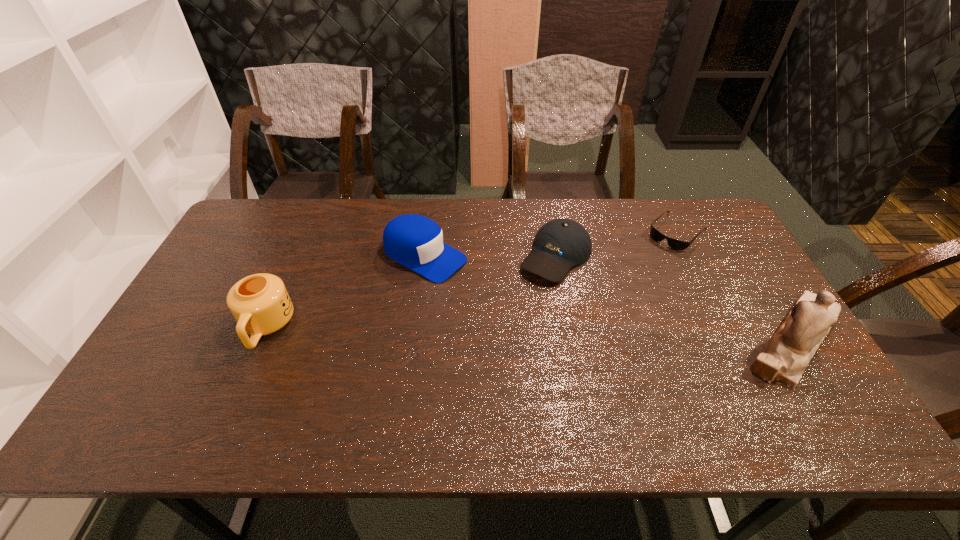
Identify the location of figurine present at the right edge. pos(785,358).

Where is `sunglasses that is at the right edge`? Image resolution: width=960 pixels, height=540 pixels. sunglasses that is at the right edge is located at coordinates (676, 244).

You are a GUI agent. You are given a task and a screenshot of the screen. Output one action in this format:
    pyautogui.click(x=<x>, y=<y>)
    Task: Click on the object present at the far right corner
    The image size is (960, 540).
    Given the screenshot: What is the action you would take?
    pyautogui.click(x=676, y=244)

Find the location of a particular element. Image resolution: width=960 pixels, height=540 pixels. object positioned at the near right corner is located at coordinates (785, 358).

At what (x,y) coordinates should I click in order to perform the action: click on vacant space at the far edge. Please return your answer as a coordinate pair (x, y). The image size is (960, 540). Looking at the image, I should click on coord(604,233).

Where is `vacant space at the near edge of the desktop`? The width and height of the screenshot is (960, 540). vacant space at the near edge of the desktop is located at coordinates [283, 393].

Identify the location of vacant space at the left edge. This screenshot has width=960, height=540. (222, 327).

The width and height of the screenshot is (960, 540). In the image, there is a desktop. Find the location of `free space at the far left corner`. free space at the far left corner is located at coordinates (249, 215).

The height and width of the screenshot is (540, 960). What are the coordinates of `unoccupied area between the shorter baseball cap and the left baseball cap` in the screenshot? It's located at pyautogui.click(x=491, y=256).

Locate an element on the screen. vacant region between the right baseball cap and the sunglasses is located at coordinates click(x=616, y=244).